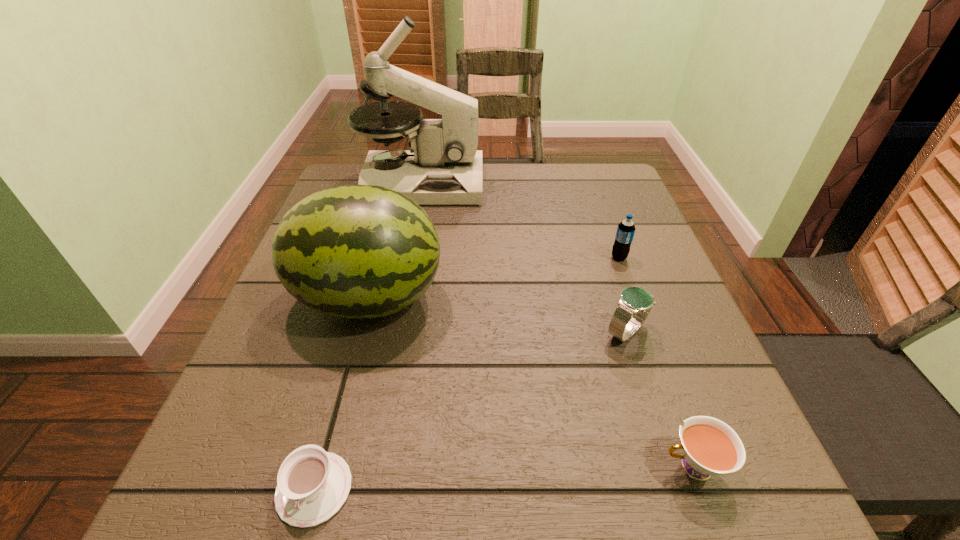
Identify the location of vacant area situated at the stem end of the fifth shortest object. (588, 299).

The image size is (960, 540). I want to click on vacant point located 0.220m on the left of the fourth shortest object, so click(x=511, y=258).

Locate an element on the screen. vacant area situated 0.090m on the right of the third shortest object is located at coordinates (699, 332).

Where is `vacant space positioned on the side of the taller teacup with the handle`? Image resolution: width=960 pixels, height=540 pixels. vacant space positioned on the side of the taller teacup with the handle is located at coordinates (387, 467).

This screenshot has width=960, height=540. I want to click on vacant space situated on the side of the taller teacup with the handle, so click(x=387, y=467).

This screenshot has height=540, width=960. I want to click on free spot located 0.150m on the side of the taller teacup with the handle, so click(555, 467).

The image size is (960, 540). I want to click on object positioned at the far edge, so tap(443, 167).

Where is `microscope situated at the left edge`? The image size is (960, 540). microscope situated at the left edge is located at coordinates (443, 167).

In order to click on watermelon at the left edge in this screenshot , I will do pyautogui.click(x=354, y=251).

This screenshot has width=960, height=540. Find the location of `teacup located at the left edge`. teacup located at the left edge is located at coordinates (312, 485).